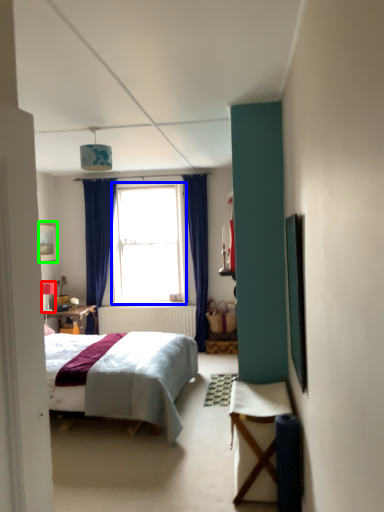
Question: Which is nearer to the lamp (highlighted by a red box)? window (highlighted by a blue box) or picture frame (highlighted by a green box).

Choices:
 (A) window
 (B) picture frame

Answer: (B)